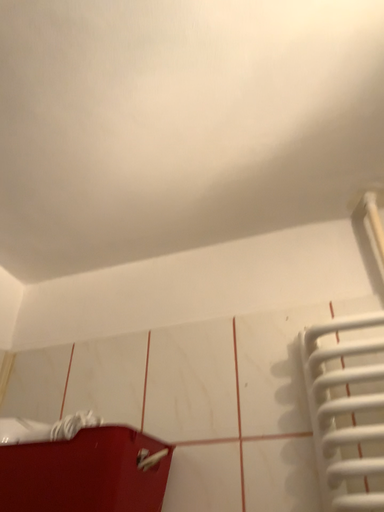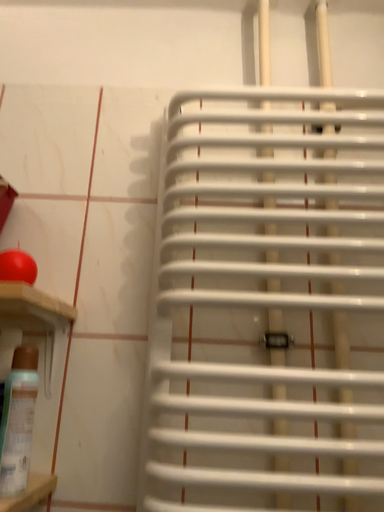
Question: How did the camera likely rotate when shooting the video?

Choices:
 (A) rotated right
 (B) rotated left

Answer: (A)